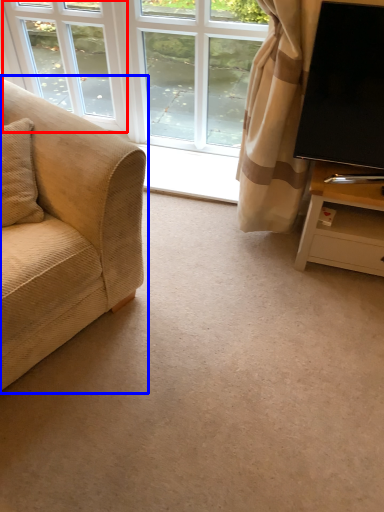
Question: Which object appears farthest to the camera in this image, window (highlighted by a red box) or studio couch (highlighted by a blue box)?

Choices:
 (A) window
 (B) studio couch

Answer: (A)